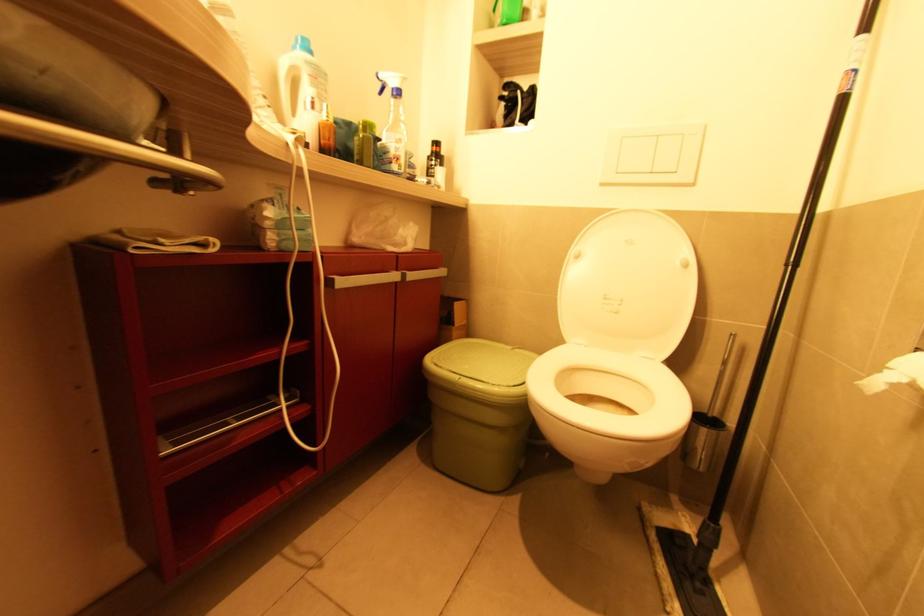
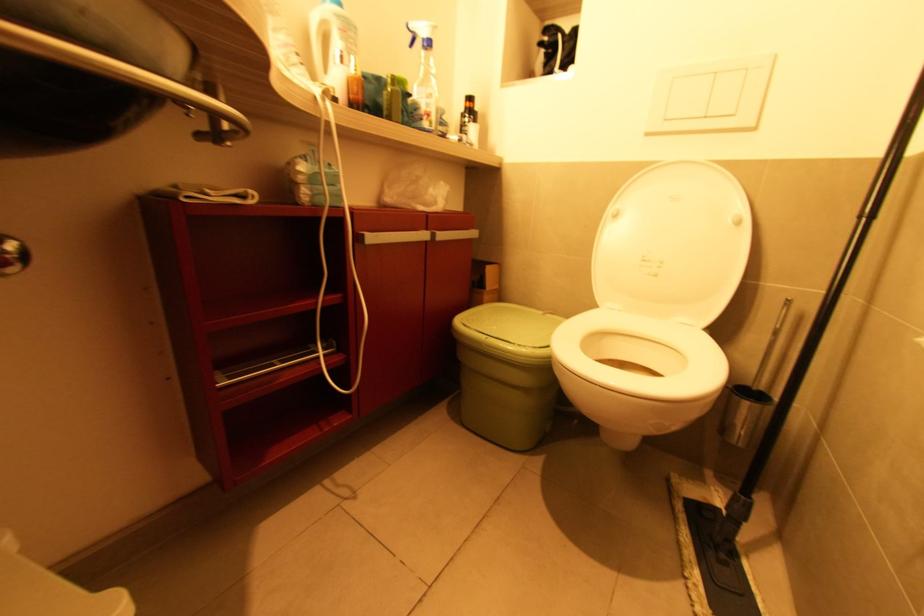
Locate, in the second image, the point that corresponds to pixel 395 90 in the first image.

(427, 42)